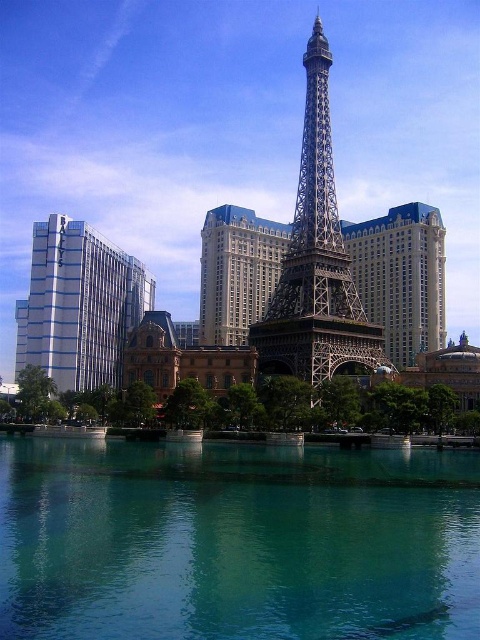
Does point (324, 180) come in front of point (68, 340)?

Yes, it is in front of point (68, 340).

Can you confirm if metallic structure at center is smaller than white glossy building at left?

Yes.

Locate an element on the screen. This screenshot has height=640, width=480. metallic structure at center is located at coordinates (316, 262).

Where is `metallic structure at center`? The width and height of the screenshot is (480, 640). metallic structure at center is located at coordinates (316, 262).

Between metallic silver eiffel tower at center and metallic structure at center, which one is positioned lower?

metallic silver eiffel tower at center is below.

Looking at this image, which is more to the right, metallic silver eiffel tower at center or metallic structure at center?

metallic structure at center

Between point (368, 228) and point (311, 218), which one is positioned in front?

Point (311, 218) is in front.

At what (x,y) coordinates should I click in order to perform the action: click on metallic silver eiffel tower at center. Please return your answer as a coordinate pair (x, y). The width and height of the screenshot is (480, 640). Looking at the image, I should click on (402, 276).

Does point (411, 538) come farther from viewer compared to point (331, 278)?

No, (411, 538) is closer to viewer.

Is point (406, 490) positioned before point (338, 358)?

Yes, it is in front of point (338, 358).

Where is `teal glassy water at center`? The height and width of the screenshot is (640, 480). teal glassy water at center is located at coordinates (236, 541).